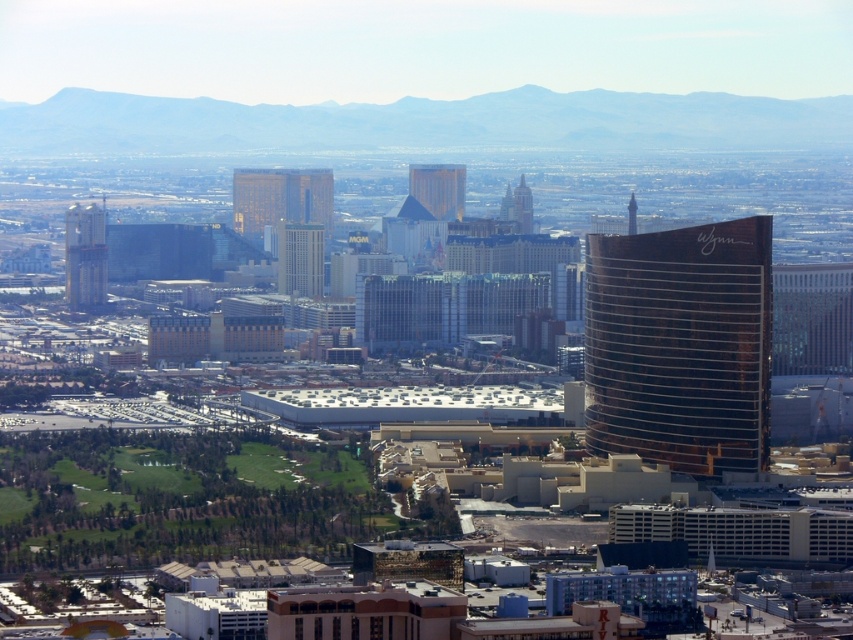
Question: Which point is farther from the camera taking this photo?

Choices:
 (A) (291, 236)
 (B) (628, 212)
 (C) (326, 224)
 (D) (434, 176)

Answer: (B)

Question: Which point is farther to the camera?

Choices:
 (A) (84, 252)
 (B) (309, 204)

Answer: (A)

Question: Which of the following is the farthest from the observer?

Choices:
 (A) (299, 266)
 (B) (444, 196)
 (C) (692, 260)

Answer: (C)

Question: Does shiny brown tower at right have a lesser width compared to gold glass tower at center?

Choices:
 (A) yes
 (B) no

Answer: (B)

Question: Can you confirm if gold reflective tower at left is positioned below glassy reflective skyscraper at center?

Choices:
 (A) yes
 (B) no

Answer: (B)

Question: Is gold glass tower at center above shiny brown tower at upper right?

Choices:
 (A) yes
 (B) no

Answer: (A)